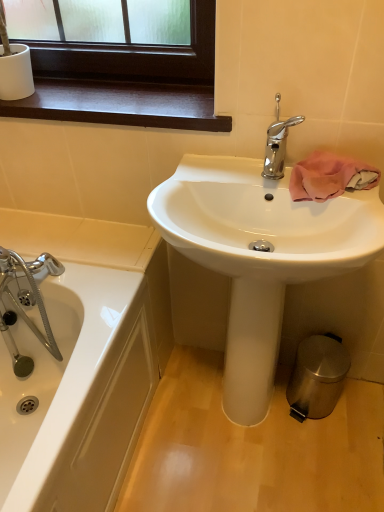
Question: Is polished chrome faucet at upper center to the right of polished stainless steel trash can at lower right from the viewer's perspective?

Choices:
 (A) no
 (B) yes

Answer: (A)

Question: Does polished chrome faucet at upper center have a larger size compared to polished stainless steel trash can at lower right?

Choices:
 (A) yes
 (B) no

Answer: (B)

Question: Is polished chrome faucet at upper center facing towards polished stainless steel trash can at lower right?

Choices:
 (A) no
 (B) yes

Answer: (A)

Question: Is polished chrome faucet at upper center in front of polished stainless steel trash can at lower right?

Choices:
 (A) no
 (B) yes

Answer: (B)

Question: Does polished chrome faucet at upper center have a lesser height compared to polished stainless steel trash can at lower right?

Choices:
 (A) no
 (B) yes

Answer: (B)

Question: Considering the positions of pink fabric towel at upper right and polished stainless steel trash can at lower right in the image, is pink fabric towel at upper right wider or thinner than polished stainless steel trash can at lower right?

Choices:
 (A) thin
 (B) wide

Answer: (A)

Question: Visually, is pink fabric towel at upper right positioned to the left or to the right of polished stainless steel trash can at lower right?

Choices:
 (A) left
 (B) right

Answer: (A)

Question: In the image, is pink fabric towel at upper right positioned in front of or behind polished stainless steel trash can at lower right?

Choices:
 (A) behind
 (B) front

Answer: (B)

Question: Considering the positions of pink fabric towel at upper right and polished stainless steel trash can at lower right in the image, is pink fabric towel at upper right taller or shorter than polished stainless steel trash can at lower right?

Choices:
 (A) short
 (B) tall

Answer: (A)

Question: Based on their positions, is dark wood window sill at upper left located to the left or right of metallic silver trash can at lower right?

Choices:
 (A) left
 (B) right

Answer: (A)

Question: Is dark wood window sill at upper left taller or shorter than metallic silver trash can at lower right?

Choices:
 (A) tall
 (B) short

Answer: (A)

Question: Is dark wood window sill at upper left wider or thinner than metallic silver trash can at lower right?

Choices:
 (A) wide
 (B) thin

Answer: (B)

Question: Considering the positions of point (61, 99) and point (324, 456), is point (61, 99) closer or farther from the camera than point (324, 456)?

Choices:
 (A) closer
 (B) farther

Answer: (A)

Question: Considering their positions, is polished stainless steel trash can at lower right located in front of or behind polished chrome faucet at upper center?

Choices:
 (A) front
 (B) behind

Answer: (B)

Question: Considering the positions of polished stainless steel trash can at lower right and polished chrome faucet at upper center in the image, is polished stainless steel trash can at lower right wider or thinner than polished chrome faucet at upper center?

Choices:
 (A) thin
 (B) wide

Answer: (B)